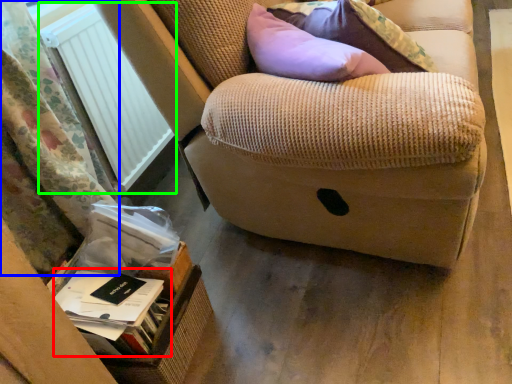
Question: Which object is the closest to the paperback book (highlighted by a red box)? Choose among these: curtain (highlighted by a blue box) or radiator (highlighted by a green box).

Choices:
 (A) curtain
 (B) radiator

Answer: (A)